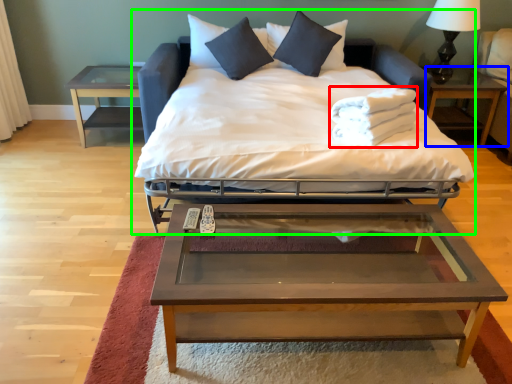
Question: Which object is the closest to the material (highlighted by a red box)? Choose among these: nightstand (highlighted by a blue box) or bed (highlighted by a green box).

Choices:
 (A) nightstand
 (B) bed

Answer: (B)